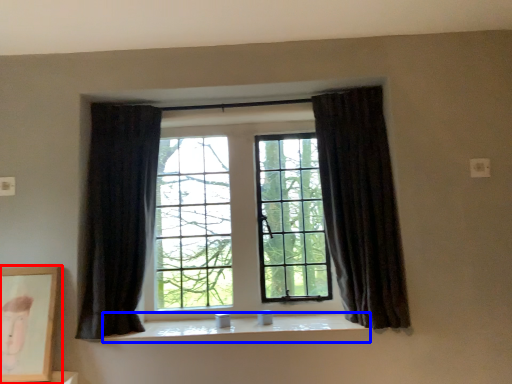
Question: Among these objects, which one is farthest to the camera, picture frame (highlighted by a red box) or window sill (highlighted by a blue box)?

Choices:
 (A) picture frame
 (B) window sill

Answer: (B)